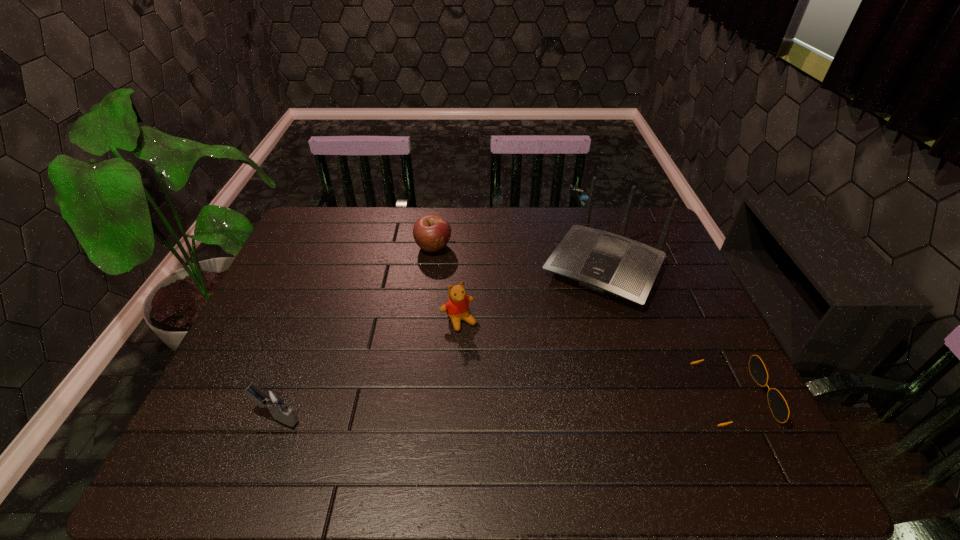
Where is `free spot between the shortest object and the teddy bear`? The image size is (960, 540). free spot between the shortest object and the teddy bear is located at coordinates (596, 357).

Where is `unoccupied position between the teddy bear and the fourth tallest object`? unoccupied position between the teddy bear and the fourth tallest object is located at coordinates (446, 284).

You are a GUI agent. You are given a task and a screenshot of the screen. Output one action in this format:
    pyautogui.click(x=<x>, y=<y>)
    Task: Click on the free space between the teddy bear and the tallest object
    The width and height of the screenshot is (960, 540).
    Given the screenshot: What is the action you would take?
    pyautogui.click(x=531, y=294)

Image resolution: width=960 pixels, height=540 pixels. What are the coordinates of `object that can be found as the third closest to the router` in the screenshot? It's located at (431, 232).

Choose which object is the nearest neighbor to the tallest object. Please provide its 2D coordinates. Your answer should be formatted as a tuple, i.e. [(x, y)], where the tuple contains the x and y coordinates of a point satisfying the conditions above.

[(778, 405)]

The height and width of the screenshot is (540, 960). What are the coordinates of `free spot that satisfies the following two spatial constraints: 1. on the front side of the teddy bear; 2. on the front-facing side of the shortest object` in the screenshot? It's located at (455, 395).

The height and width of the screenshot is (540, 960). In order to click on free region that satisfies the following two spatial constraints: 1. on the front side of the shortest object; 2. on the front-facing side of the router in this screenshot , I will do `click(643, 395)`.

At what (x,y) coordinates should I click in order to perform the action: click on free space that satisfies the following two spatial constraints: 1. on the front side of the tallest object; 2. on the front-facing side of the shortest object. Please return your answer as a coordinate pair (x, y). Looking at the image, I should click on (643, 395).